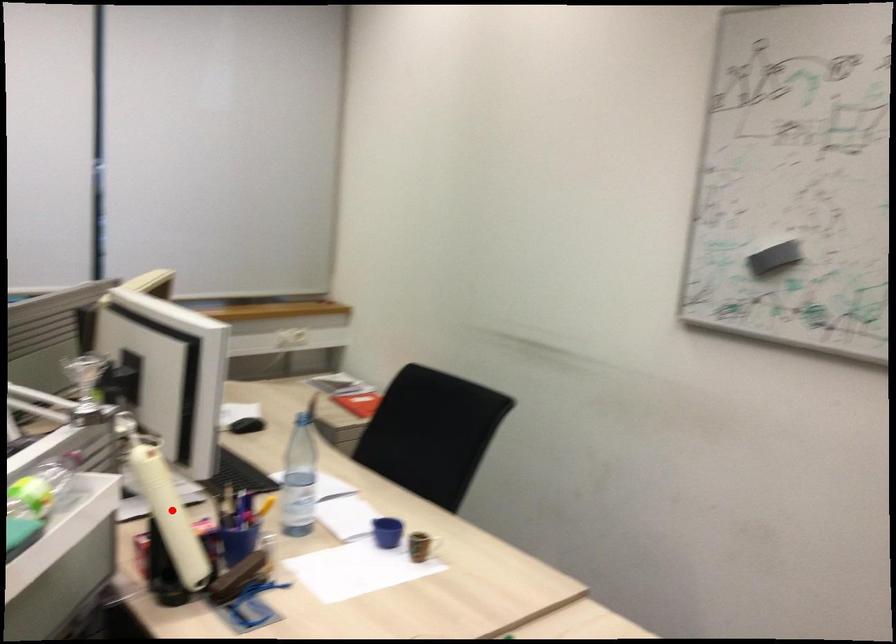
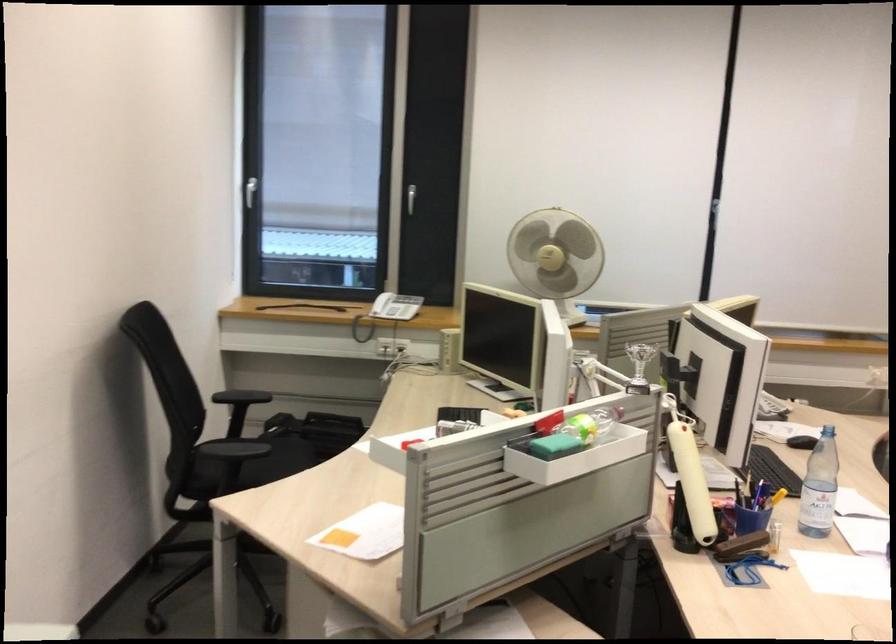
Question: I am providing you with two images of the same scene from different viewpoints. In image1, a red point is highlighted. Considering the same 3D point in image2, which of the following is correct?

Choices:
 (A) It is closer
 (B) It is farther

Answer: (B)